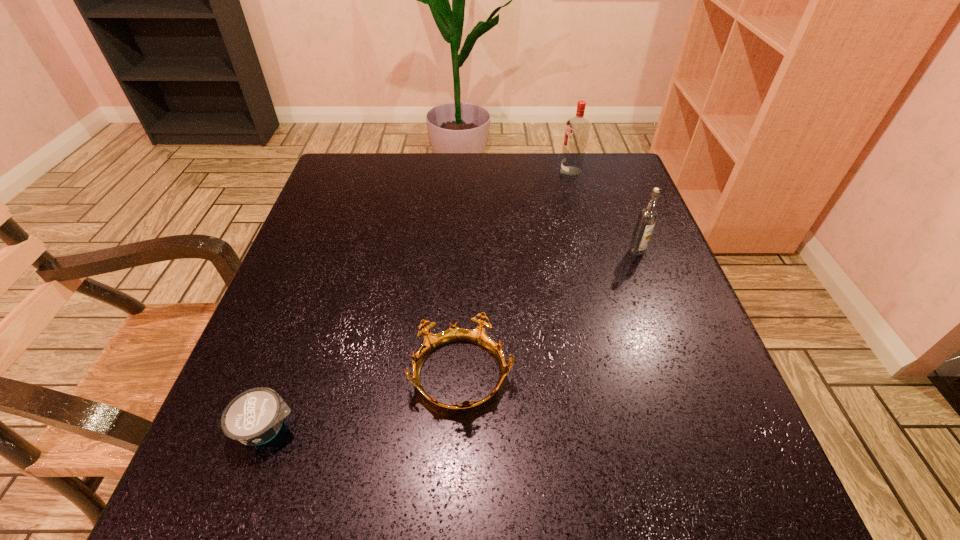
At what (x,y) coordinates should I click in order to perform the action: click on vacant space at the right edge. Please return your answer as a coordinate pair (x, y). This screenshot has width=960, height=540. Looking at the image, I should click on (613, 311).

You are a GUI agent. You are given a task and a screenshot of the screen. Output one action in this format:
    pyautogui.click(x=<x>, y=<y>)
    Task: Click on the vacant region at the far left corner
    
    Given the screenshot: What is the action you would take?
    pyautogui.click(x=384, y=176)

This screenshot has height=540, width=960. In order to click on vacant space at the near left corner in this screenshot , I will do `click(242, 482)`.

You are a GUI agent. You are given a task and a screenshot of the screen. Output one action in this format:
    pyautogui.click(x=<x>, y=<y>)
    Task: Click on the vacant point at the far right corner
    The width and height of the screenshot is (960, 540).
    Given the screenshot: What is the action you would take?
    pyautogui.click(x=589, y=162)

Locate an element on the screen. This screenshot has height=540, width=960. blank area at the near right corner is located at coordinates (700, 483).

Locate an element on the screen. The height and width of the screenshot is (540, 960). vacant area that lies between the left vodka and the right vodka is located at coordinates (604, 212).

Locate an element on the screen. unoccupied position between the third object from right to left and the left vodka is located at coordinates (516, 274).

Identify the location of free space between the yogurt and the crown. (365, 402).

I want to click on free space between the yogurt and the second shortest object, so click(x=365, y=402).

Where is `free spot between the crown and the rightmost object`? The height and width of the screenshot is (540, 960). free spot between the crown and the rightmost object is located at coordinates (549, 314).